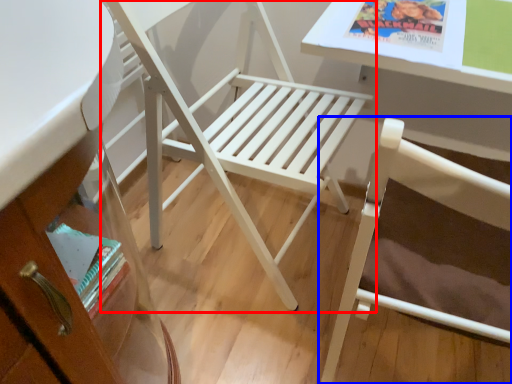
Question: Which object is further to the camera taking this photo, chair (highlighted by a red box) or chair (highlighted by a blue box)?

Choices:
 (A) chair
 (B) chair

Answer: (A)